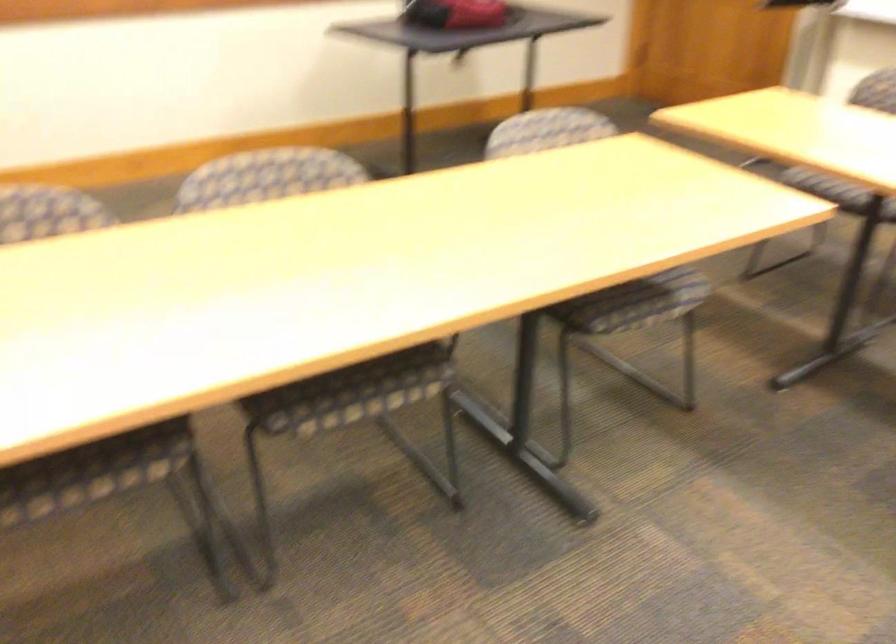
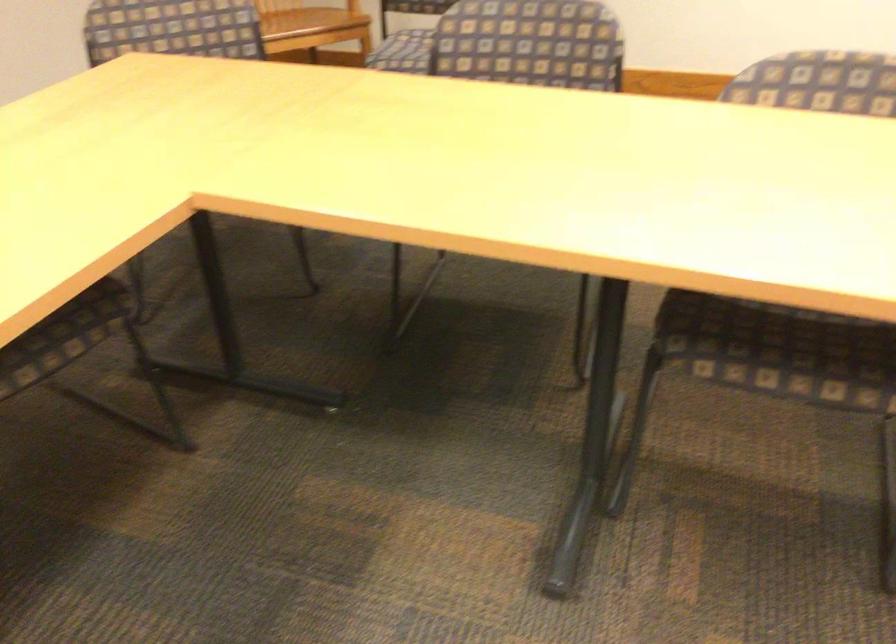
Question: Based on the continuous images, in which direction is the camera rotating? Reply with the corresponding letter.

Choices:
 (A) Left
 (B) Right
 (C) Up
 (D) Down

Answer: (A)